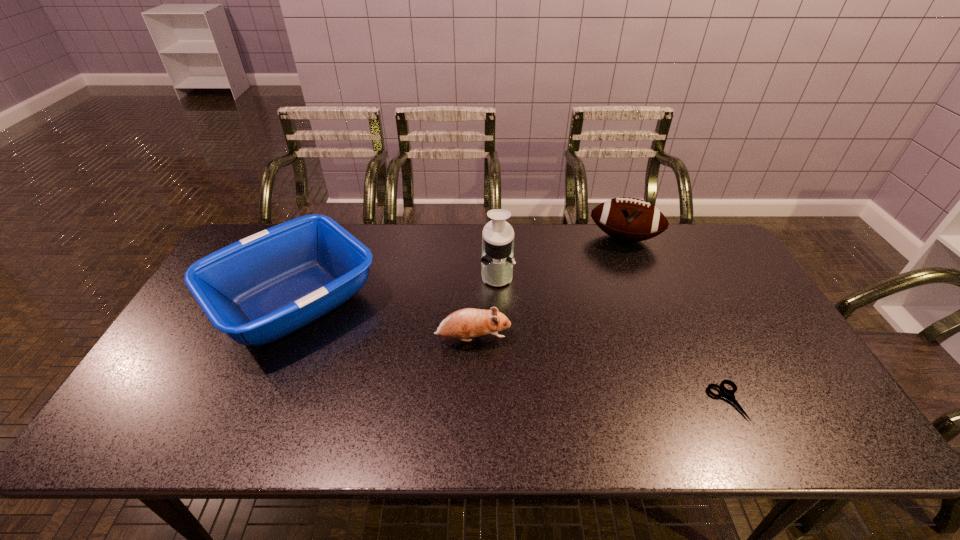
The width and height of the screenshot is (960, 540). In order to click on free spot between the hamster and the juicer in this screenshot , I will do `click(485, 306)`.

Locate an element on the screen. The image size is (960, 540). the closest object relative to the football (American) is located at coordinates (497, 260).

Locate an element on the screen. Image resolution: width=960 pixels, height=540 pixels. object that is the second closest to the shears is located at coordinates (628, 219).

Locate an element on the screen. vacant space that satisfies the following two spatial constraints: 1. on the back side of the tallest object; 2. on the right side of the football (American) is located at coordinates (495, 238).

Where is `blank area in the image that satisfies the following two spatial constraints: 1. on the front side of the shears; 2. on the right side of the football (American)`? This screenshot has width=960, height=540. blank area in the image that satisfies the following two spatial constraints: 1. on the front side of the shears; 2. on the right side of the football (American) is located at coordinates (690, 401).

Find the location of a particular element. This screenshot has height=540, width=960. vacant region that satisfies the following two spatial constraints: 1. on the front side of the juicer; 2. at the face of the fourth tallest object is located at coordinates (499, 339).

Where is `free space that satisfies the following two spatial constraints: 1. on the back side of the tray; 2. on the right side of the tallest object`? Image resolution: width=960 pixels, height=540 pixels. free space that satisfies the following two spatial constraints: 1. on the back side of the tray; 2. on the right side of the tallest object is located at coordinates (306, 274).

This screenshot has width=960, height=540. Find the location of `vacant point that satisfies the following two spatial constraints: 1. on the back side of the juicer; 2. on the right side of the football (American)`. vacant point that satisfies the following two spatial constraints: 1. on the back side of the juicer; 2. on the right side of the football (American) is located at coordinates (495, 238).

Locate an element on the screen. vacant space that satisfies the following two spatial constraints: 1. on the back side of the juicer; 2. on the left side of the leftmost object is located at coordinates (306, 274).